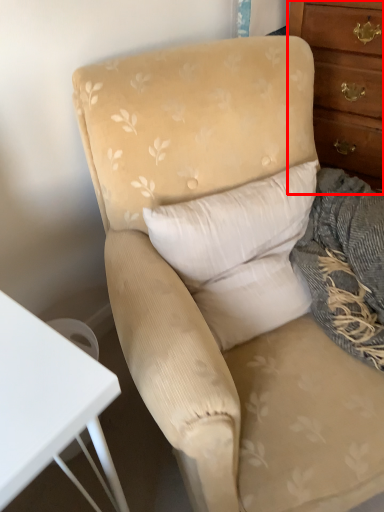
Question: From the image's perspective, what is the correct spatial positioning of chest of drawers (annotated by the red box) in reference to pillow?

Choices:
 (A) below
 (B) above

Answer: (B)